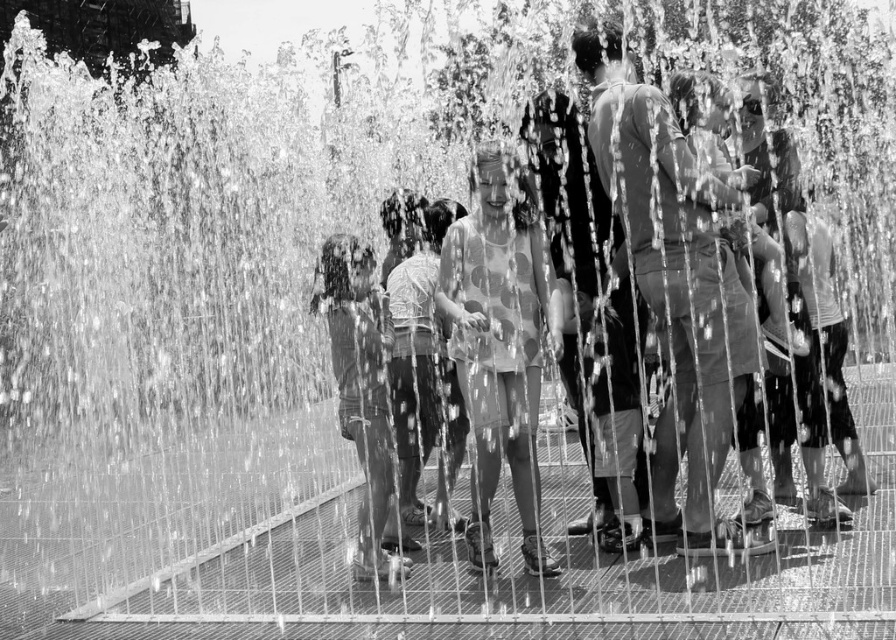
Is matte gray shorts at center positioned at the back of smooth fabric shirt at center?

No.

Where is `matte gray shorts at center`? The width and height of the screenshot is (896, 640). matte gray shorts at center is located at coordinates (675, 284).

The height and width of the screenshot is (640, 896). What are the coordinates of `polka dot fabric dress at center` in the screenshot? It's located at (501, 342).

Can you confirm if matte gray shorts at center is positioned above polka dot fabric dress at center?

Correct, matte gray shorts at center is located above polka dot fabric dress at center.

Does point (698, 344) lie in front of point (453, 348)?

That is True.

Is point (593, 140) positioned after point (553, 308)?

That is True.

This screenshot has height=640, width=896. I want to click on matte gray shorts at center, so click(x=675, y=284).